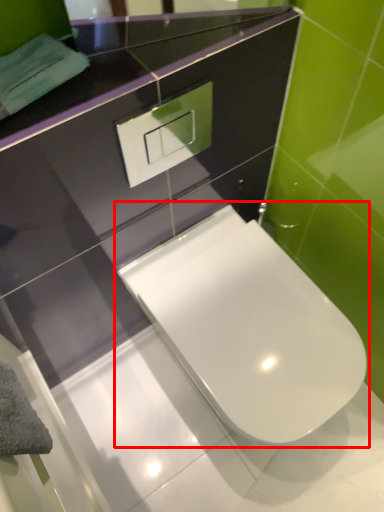
Question: From the image, what is the correct spatial relationship of toilet (annotated by the red box) in relation to mirror?

Choices:
 (A) left
 (B) right

Answer: (B)